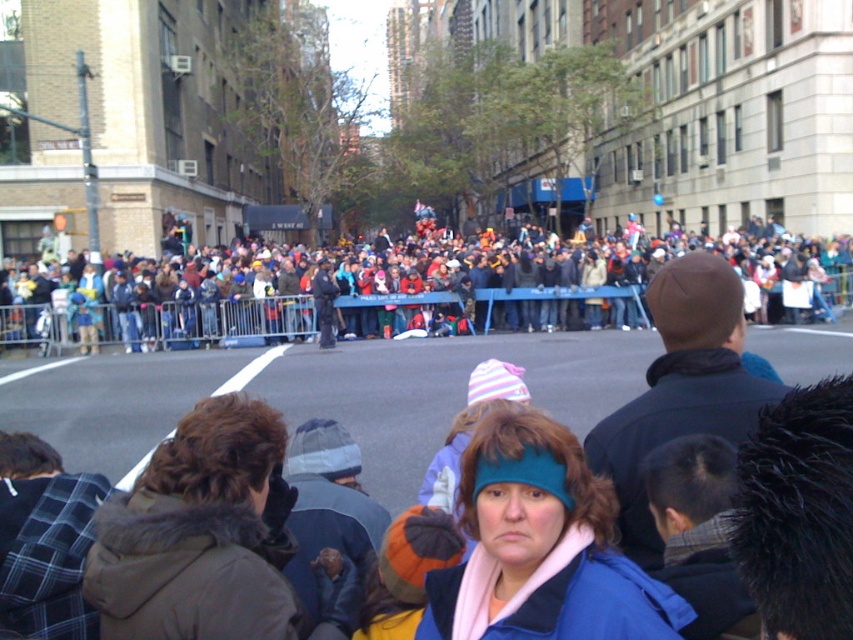
Which of these two, multicolored fabric crowd at center or blue fleece jacket at center, stands shorter?

Standing shorter between the two is blue fleece jacket at center.

Is point (343, 280) more distant than point (488, 508)?

Yes, point (343, 280) is behind point (488, 508).

Does point (421, 243) come closer to viewer compared to point (585, 596)?

No, it is not.

The image size is (853, 640). Identify the location of multicolored fabric crowd at center. (410, 289).